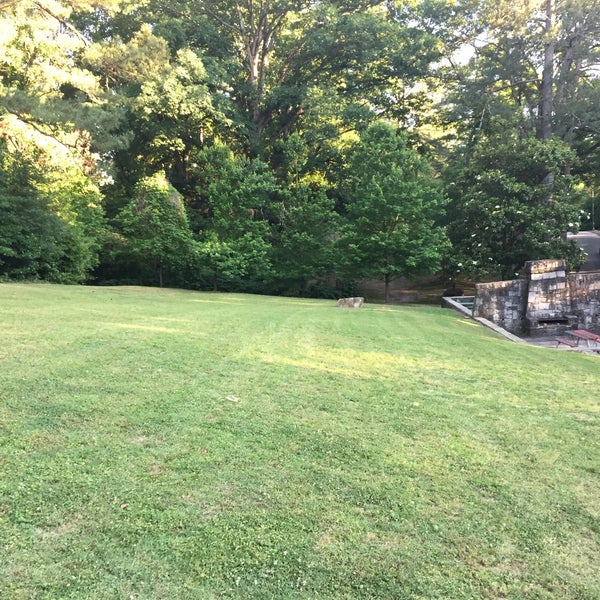
The width and height of the screenshot is (600, 600). In order to click on bench seat in this screenshot , I will do `click(567, 343)`.